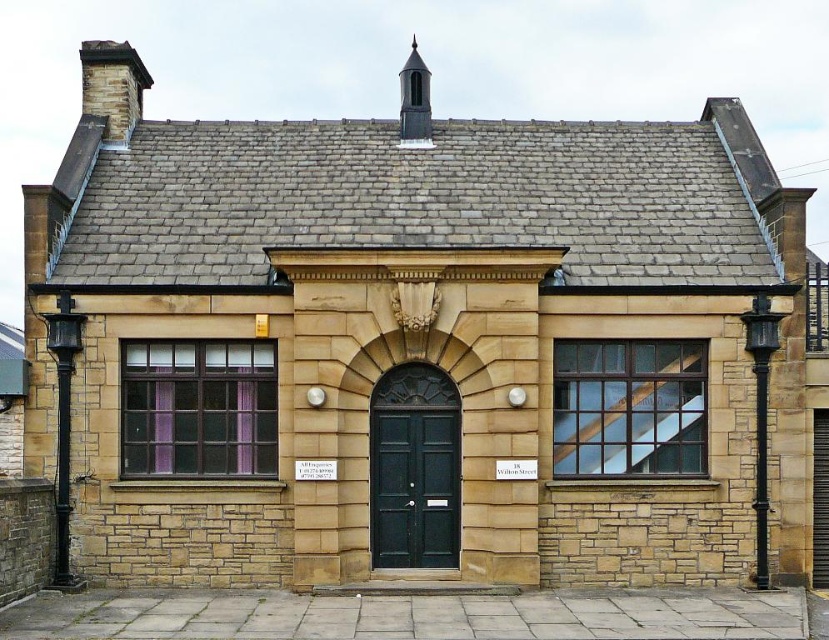
Question: From the image, what is the correct spatial relationship of brown stone chimney at upper left in relation to smooth gray chimney at upper center?

Choices:
 (A) left
 (B) right

Answer: (A)

Question: Which of the following is the farthest from the observer?

Choices:
 (A) brown stone chimney at upper left
 (B) smooth gray chimney at upper center

Answer: (B)

Question: Does brown stone chimney at upper left have a lesser width compared to smooth gray chimney at upper center?

Choices:
 (A) yes
 (B) no

Answer: (B)

Question: Can you confirm if brown stone chimney at upper left is positioned to the left of smooth gray chimney at upper center?

Choices:
 (A) yes
 (B) no

Answer: (A)